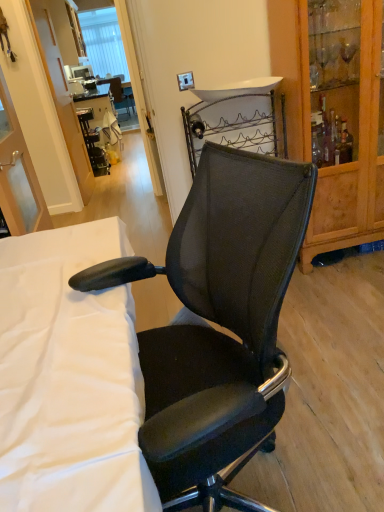
Question: From a real-world perspective, is black plastic table at center positioned above or below wooden cabinet at right?

Choices:
 (A) below
 (B) above

Answer: (A)

Question: In the image, is black plastic table at center on the left side or the right side of wooden cabinet at right?

Choices:
 (A) left
 (B) right

Answer: (A)

Question: Estimate the real-world distances between objects in this image. Which object is farther from the black mesh office chair at center?

Choices:
 (A) black plastic table at center
 (B) white fabric at center
 (C) wooden cabinet at right

Answer: (A)

Question: Which is farther from the white fabric at center?

Choices:
 (A) black plastic table at center
 (B) black mesh office chair at center
 (C) wooden cabinet at right

Answer: (A)